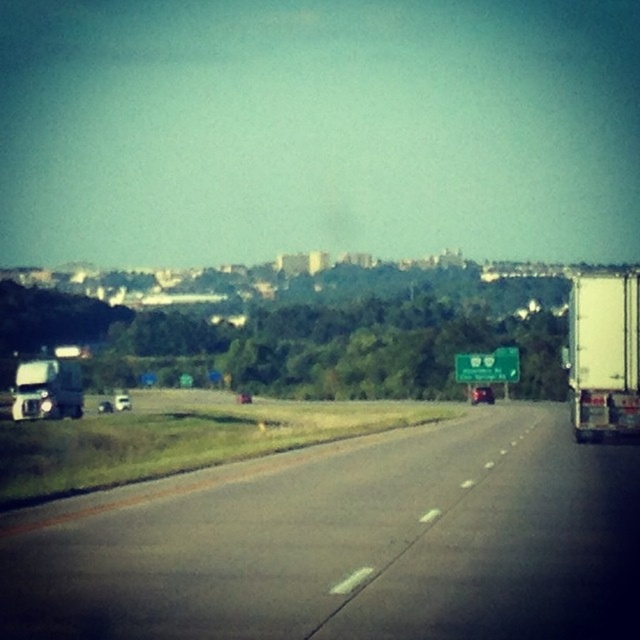
Is white matte trailer truck at right above white matte truck at left?

Indeed, white matte trailer truck at right is positioned over white matte truck at left.

From the picture: Is white matte trailer truck at right to the right of white matte truck at left from the viewer's perspective?

Yes, white matte trailer truck at right is to the right of white matte truck at left.

This screenshot has height=640, width=640. Identify the location of white matte trailer truck at right. (604, 355).

Identify the location of white matte trailer truck at right. (604, 355).

Between black asphalt highway at center and white matte trailer truck at right, which one appears on the right side from the viewer's perspective?

white matte trailer truck at right is more to the right.

Is black asphalt highway at center smaller than white matte trailer truck at right?

Yes, black asphalt highway at center is smaller than white matte trailer truck at right.

Is point (40, 584) less distant than point (605, 404)?

Yes, it is in front of point (605, 404).

Image resolution: width=640 pixels, height=640 pixels. What are the coordinates of `black asphalt highway at center` in the screenshot? It's located at (348, 544).

Is black asphalt highway at center wider than white matte truck at left?

In fact, black asphalt highway at center might be narrower than white matte truck at left.

What do you see at coordinates (348, 544) in the screenshot? I see `black asphalt highway at center` at bounding box center [348, 544].

You are a GUI agent. You are given a task and a screenshot of the screen. Output one action in this format:
    pyautogui.click(x=<x>, y=<y>)
    Task: Click on the black asphalt highway at center
    The height and width of the screenshot is (640, 640).
    Given the screenshot: What is the action you would take?
    pyautogui.click(x=348, y=544)